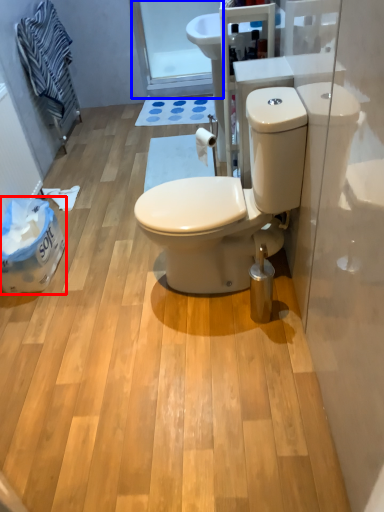
Question: Which object appears closest to the camera in this image, garbage (highlighted by a red box) or glass door (highlighted by a blue box)?

Choices:
 (A) garbage
 (B) glass door

Answer: (A)